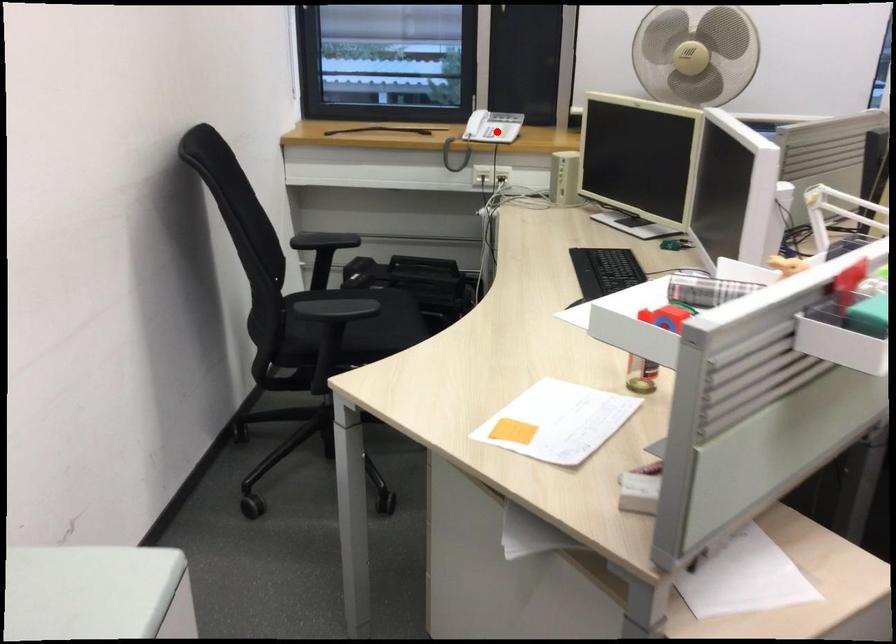
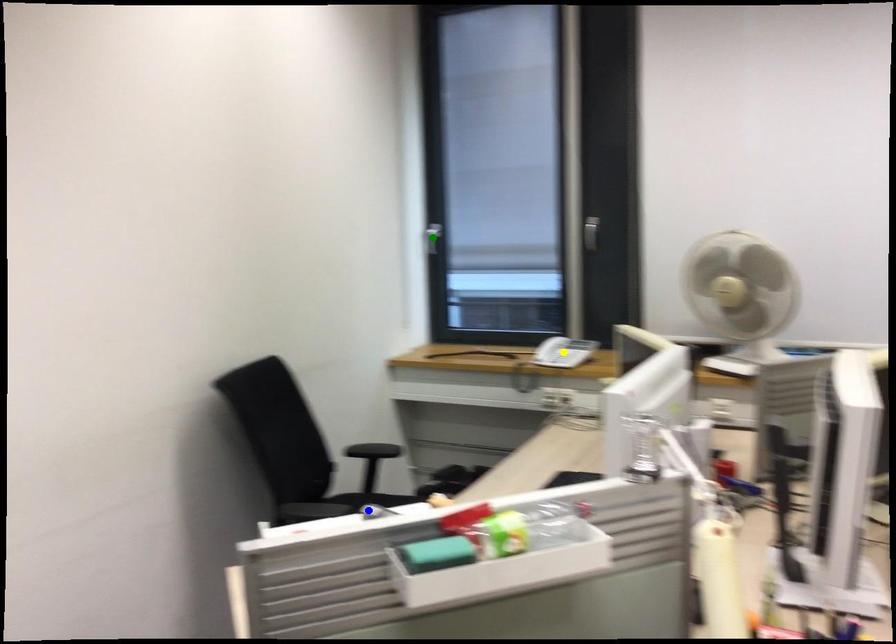
Question: I am providing you with two images of the same scene from different viewpoints. A red point is marked on the first image. You are given multiple points on the second image. Can you choose the point in image 2 that corresponds to the point in image 1?

Choices:
 (A) blue point
 (B) yellow point
 (C) green point

Answer: (B)